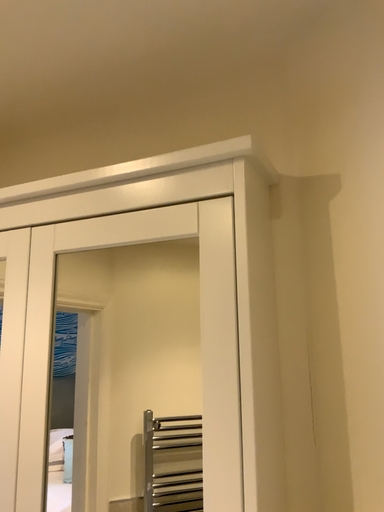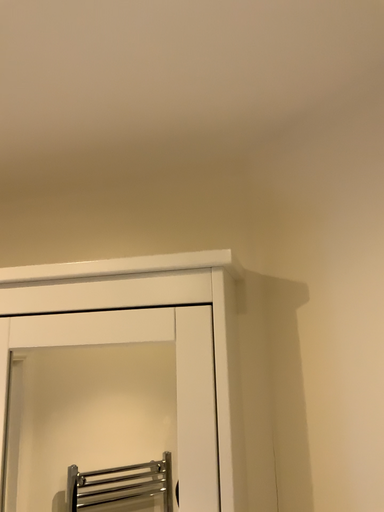
Question: Which way did the camera rotate in the video?

Choices:
 (A) rotated right
 (B) rotated left

Answer: (A)